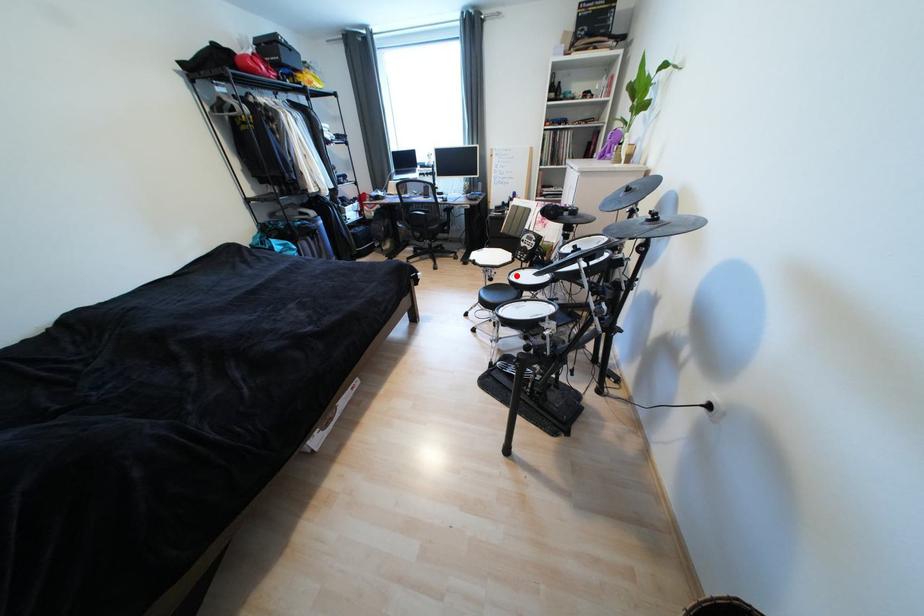
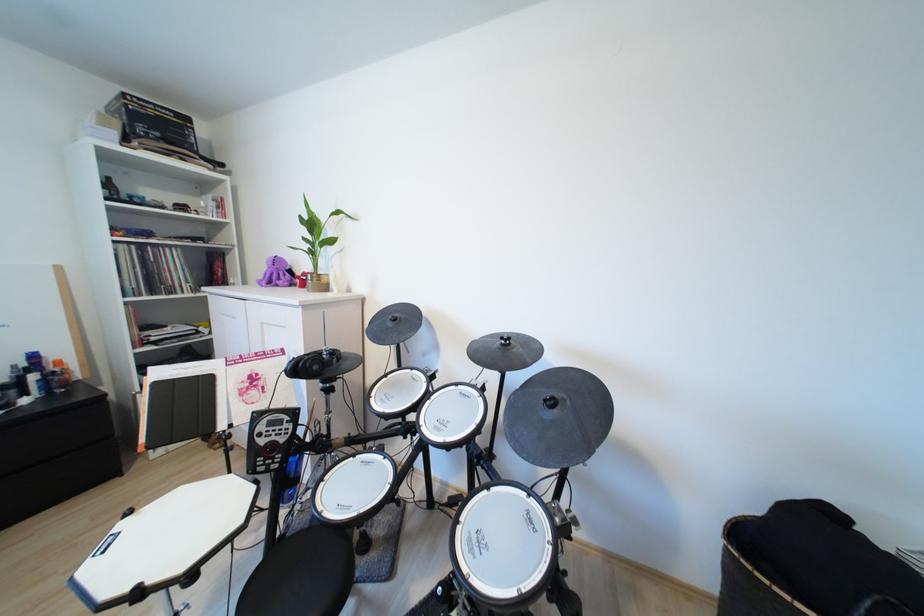
Question: I am providing you with two images of the same scene from different viewpoints. A red point is shown in image1. For the corresponding object point in image2, is it positioned nearer or farther from the camera?

Choices:
 (A) Nearer
 (B) Farther

Answer: (B)